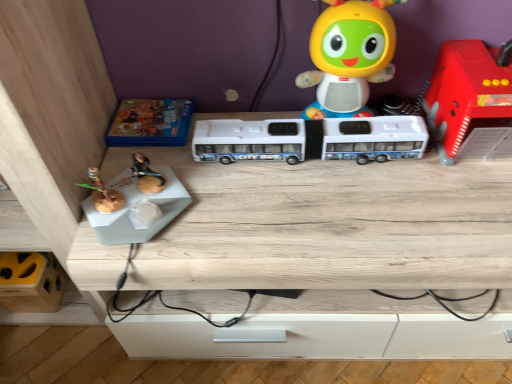
Question: Considering the relative positions of white plastic bus at center, the 3th toy positioned from the left, and blue cardboard box at upper left, the second toy in the left-to-right sequence, in the image provided, is white plastic bus at center, the 3th toy positioned from the left, to the right of blue cardboard box at upper left, the second toy in the left-to-right sequence, from the viewer's perspective?

Choices:
 (A) yes
 (B) no

Answer: (A)

Question: Is white plastic bus at center, the 3th toy positioned from the left, positioned with its back to blue cardboard box at upper left, the second toy in the left-to-right sequence?

Choices:
 (A) no
 (B) yes

Answer: (A)

Question: Is white plastic bus at center, acting as the third toy starting from the right, smaller than blue cardboard box at upper left, placed as the fourth toy when sorted from right to left?

Choices:
 (A) no
 (B) yes

Answer: (A)

Question: Can you confirm if white plastic bus at center, the 3th toy positioned from the left, is taller than blue cardboard box at upper left, placed as the fourth toy when sorted from right to left?

Choices:
 (A) no
 (B) yes

Answer: (B)

Question: Is the depth of white plastic bus at center, the 3th toy positioned from the left, greater than that of blue cardboard box at upper left, placed as the fourth toy when sorted from right to left?

Choices:
 (A) no
 (B) yes

Answer: (A)

Question: Considering the positions of point (157, 99) and point (362, 46), is point (157, 99) closer or farther from the camera than point (362, 46)?

Choices:
 (A) closer
 (B) farther

Answer: (B)

Question: In terms of height, does blue cardboard box at upper left, the second toy in the left-to-right sequence, look taller or shorter compared to matte plastic toy at upper center, marked as the fourth toy in a left-to-right arrangement?

Choices:
 (A) short
 (B) tall

Answer: (A)

Question: Which is correct: blue cardboard box at upper left, placed as the fourth toy when sorted from right to left, is inside matte plastic toy at upper center, arranged as the 2th toy when viewed from the right, or outside of it?

Choices:
 (A) inside
 (B) outside

Answer: (B)

Question: From a real-world perspective, is blue cardboard box at upper left, the second toy in the left-to-right sequence, positioned above or below matte plastic toy at upper center, marked as the fourth toy in a left-to-right arrangement?

Choices:
 (A) above
 (B) below

Answer: (B)

Question: In the image, is blue cardboard box at upper left, placed as the fourth toy when sorted from right to left, positioned in front of or behind rubberized red fire truck at right, which is the 1th toy in right-to-left order?

Choices:
 (A) behind
 (B) front

Answer: (A)

Question: In the image, is blue cardboard box at upper left, the second toy in the left-to-right sequence, on the left side or the right side of rubberized red fire truck at right, which is the 1th toy in right-to-left order?

Choices:
 (A) right
 (B) left

Answer: (B)

Question: Based on their sizes in the image, would you say blue cardboard box at upper left, the second toy in the left-to-right sequence, is bigger or smaller than rubberized red fire truck at right, the 5th toy positioned from the left?

Choices:
 (A) small
 (B) big

Answer: (A)

Question: Do you think blue cardboard box at upper left, placed as the fourth toy when sorted from right to left, is within rubberized red fire truck at right, the 5th toy positioned from the left, or outside of it?

Choices:
 (A) outside
 (B) inside

Answer: (A)

Question: From a real-world perspective, is wooden table at center above or below white plastic bus at center, acting as the third toy starting from the right?

Choices:
 (A) above
 (B) below

Answer: (B)

Question: From the image's perspective, is wooden table at center located above or below white plastic bus at center, acting as the third toy starting from the right?

Choices:
 (A) above
 (B) below

Answer: (B)